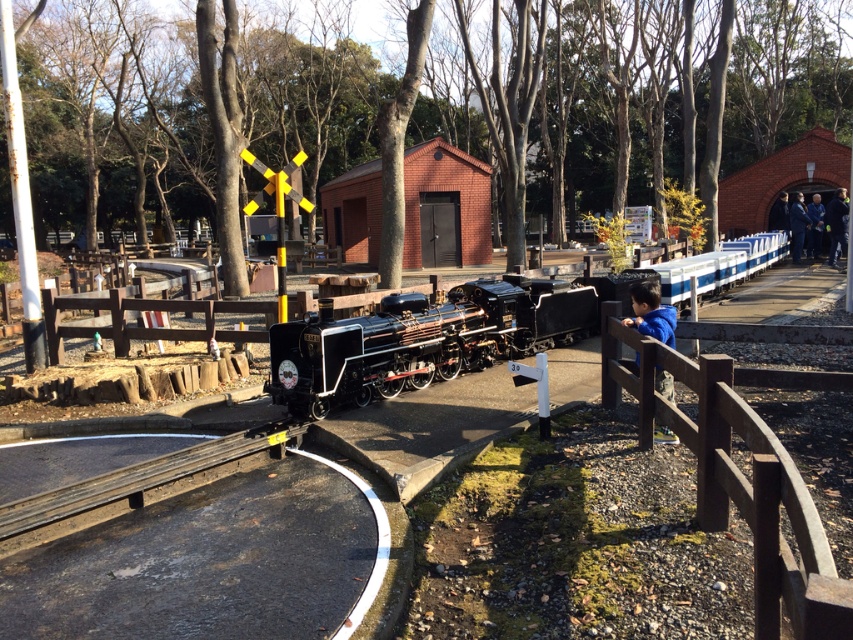
You are a visitor at the miniature railway park. You want to take a photo of the polished black locomotive at center without any obstructions. However, there is a brown wooden fence at center in the way. Can you adjust your position to capture the locomotive without the fence blocking the view?

The polished black locomotive at center is positioned over the brown wooden fence at center, so moving to a lower angle or position might allow you to capture the locomotive without the fence obstructing the view.

You are a parent trying to ensure your child stays safe while watching the train. The brown wooden fence at center and the blue fleece jacket at center are both in the area. Which object would block the child more effectively from accessing the train tracks?

The brown wooden fence at center is larger in size than the blue fleece jacket at center, so the brown wooden fence at center would block the child more effectively from accessing the train tracks.

Looking at this image, you are a miniature train enthusiast who wants to know if the polished black locomotive at center can fit through a gap in the brown wooden fence at center. Based on their widths, can it pass through?

The polished black locomotive at center is wider than the brown wooden fence at center, so it cannot pass through the gap.